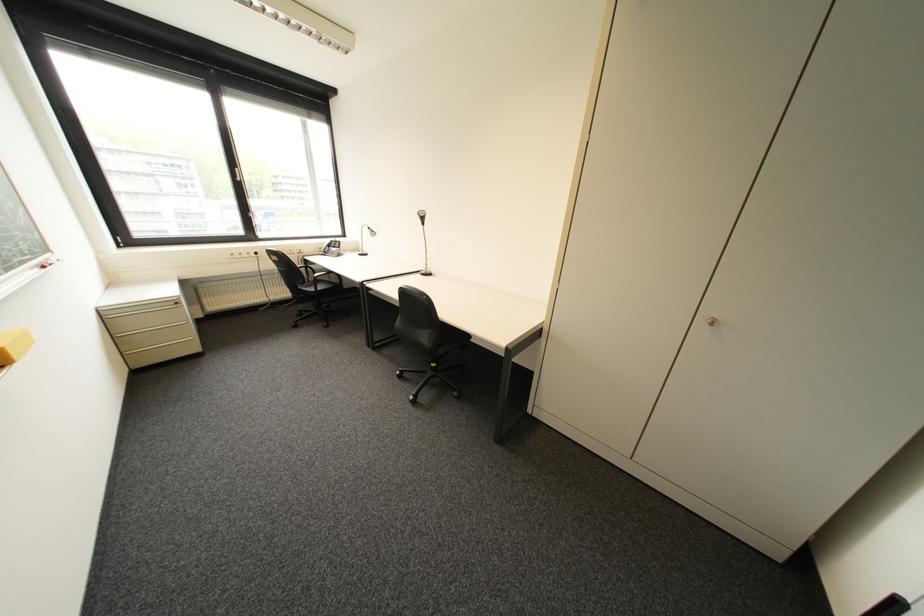
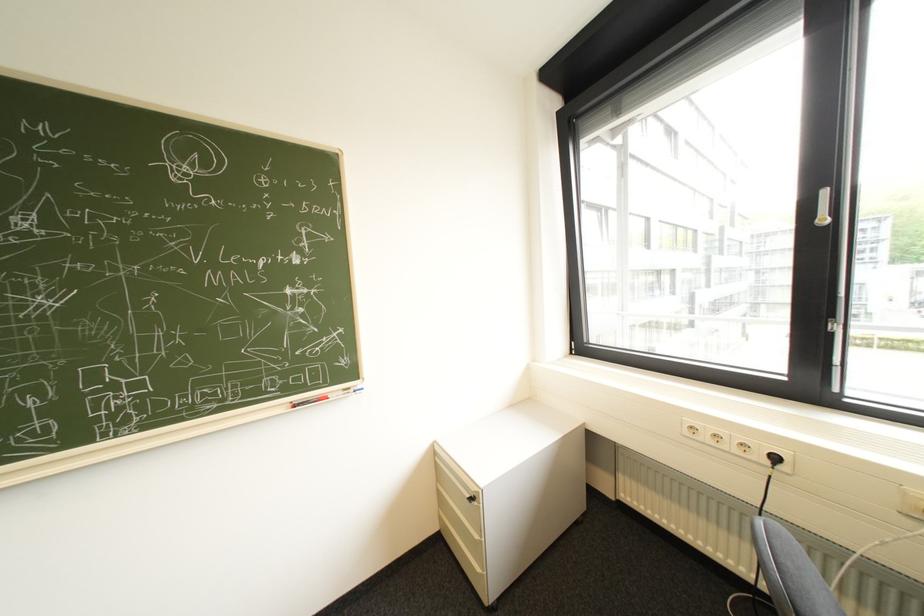
In the second image, find the point that corresponds to [248,257] in the first image.

(715, 438)